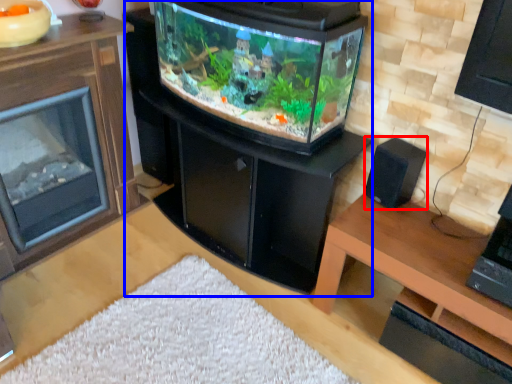
Question: Which object is further to the camera taking this photo, speaker (highlighted by a red box) or fireplace (highlighted by a blue box)?

Choices:
 (A) speaker
 (B) fireplace

Answer: (A)